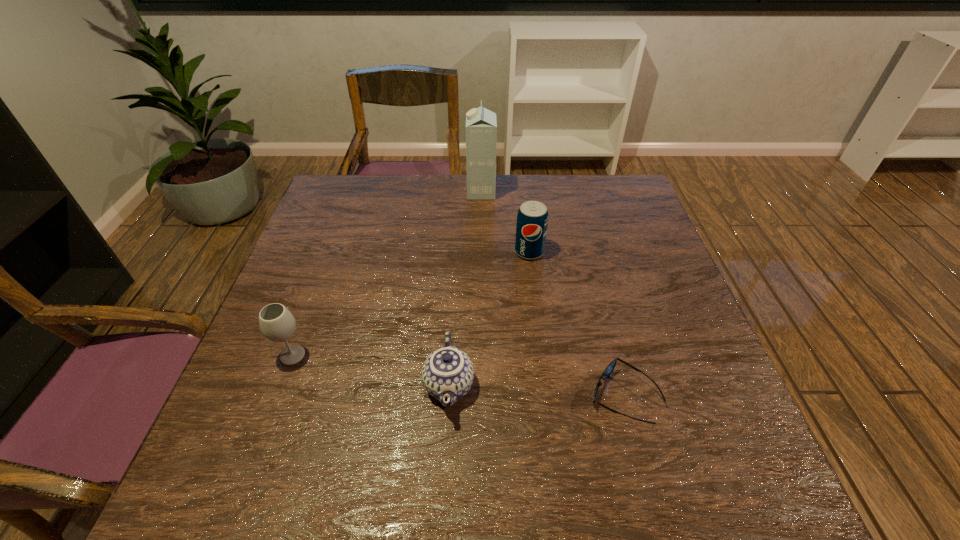
Where is `free space located 0.260m on the front label of the farthest object`? free space located 0.260m on the front label of the farthest object is located at coordinates (385, 192).

At what (x,y) coordinates should I click in order to perform the action: click on free space located on the front of the pop. Please return your answer as a coordinate pair (x, y). Looking at the image, I should click on coord(538,323).

Locate an element on the screen. vacant area located 0.220m on the front of the wineglass is located at coordinates [x=248, y=475].

Find the location of a particular element. free spot located 0.080m from the spout of the second shortest object is located at coordinates (444, 467).

Where is `free space located 0.190m at the front of the rightmost object showing the lenses`? Image resolution: width=960 pixels, height=540 pixels. free space located 0.190m at the front of the rightmost object showing the lenses is located at coordinates (492, 396).

You are a GUI agent. You are given a task and a screenshot of the screen. Output one action in this format:
    pyautogui.click(x=<x>, y=<y>)
    Task: Click on the free space located 0.350m at the front of the rightmost object showing the lenses
    The width and height of the screenshot is (960, 540).
    Given the screenshot: What is the action you would take?
    pyautogui.click(x=410, y=396)

This screenshot has height=540, width=960. I want to click on vacant space located 0.220m at the front of the rightmost object showing the lenses, so click(476, 396).

The width and height of the screenshot is (960, 540). Identify the location of object at the far edge. (481, 124).

At what (x,y) coordinates should I click in order to perform the action: click on object positioned at the left edge. Please return your answer as a coordinate pair (x, y). This screenshot has height=540, width=960. Looking at the image, I should click on (277, 324).

This screenshot has width=960, height=540. What are the coordinates of `object that is at the right edge` in the screenshot? It's located at (611, 366).